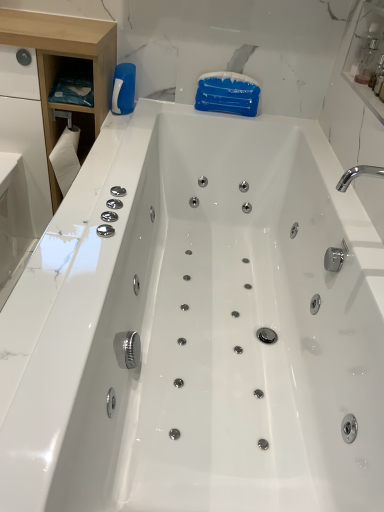
Question: From a real-world perspective, is transparent plastic bottle at upper right beneath white paper towel at left?

Choices:
 (A) no
 (B) yes

Answer: (A)

Question: Is transparent plastic bottle at upper right next to white paper towel at left and touching it?

Choices:
 (A) yes
 (B) no

Answer: (B)

Question: Is transparent plastic bottle at upper right further to camera compared to white paper towel at left?

Choices:
 (A) yes
 (B) no

Answer: (B)

Question: Are transparent plastic bottle at upper right and white paper towel at left far apart?

Choices:
 (A) no
 (B) yes

Answer: (B)

Question: Is transparent plastic bottle at upper right surrounding white paper towel at left?

Choices:
 (A) no
 (B) yes

Answer: (A)

Question: In terms of width, does transparent plastic bottle at upper right look wider or thinner when compared to white wood cabinet at left?

Choices:
 (A) thin
 (B) wide

Answer: (A)

Question: Is transparent plastic bottle at upper right to the left or to the right of white wood cabinet at left in the image?

Choices:
 (A) right
 (B) left

Answer: (A)

Question: From the image's perspective, relative to white wood cabinet at left, is transparent plastic bottle at upper right above or below?

Choices:
 (A) above
 (B) below

Answer: (A)

Question: Choose the correct answer: Is transparent plastic bottle at upper right inside white wood cabinet at left or outside it?

Choices:
 (A) outside
 (B) inside

Answer: (A)

Question: From a real-world perspective, relative to transparent plastic bottle at upper right, is white plastic bottle at upper left vertically above or below?

Choices:
 (A) above
 (B) below

Answer: (B)

Question: Would you say white plastic bottle at upper left is inside or outside transparent plastic bottle at upper right?

Choices:
 (A) outside
 (B) inside

Answer: (A)

Question: Considering their positions, is white plastic bottle at upper left located in front of or behind transparent plastic bottle at upper right?

Choices:
 (A) behind
 (B) front

Answer: (A)

Question: Is point (117, 75) positioned closer to the camera than point (375, 42)?

Choices:
 (A) farther
 (B) closer

Answer: (A)

Question: From a real-world perspective, relative to transparent plastic bottle at upper right, is white wood cabinet at left vertically above or below?

Choices:
 (A) above
 (B) below

Answer: (B)

Question: Based on their sizes in the image, would you say white wood cabinet at left is bigger or smaller than transparent plastic bottle at upper right?

Choices:
 (A) small
 (B) big

Answer: (B)